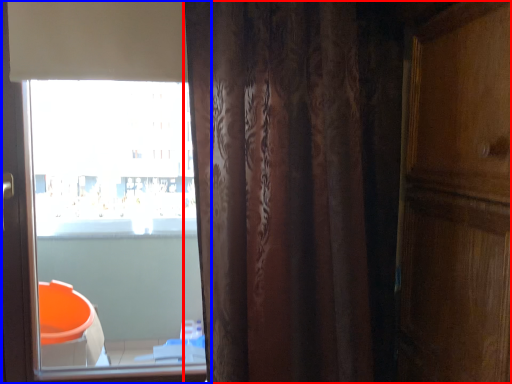
Question: Which of the following is the closest to the observer, curtain (highlighted by a red box) or window (highlighted by a blue box)?

Choices:
 (A) curtain
 (B) window

Answer: (A)